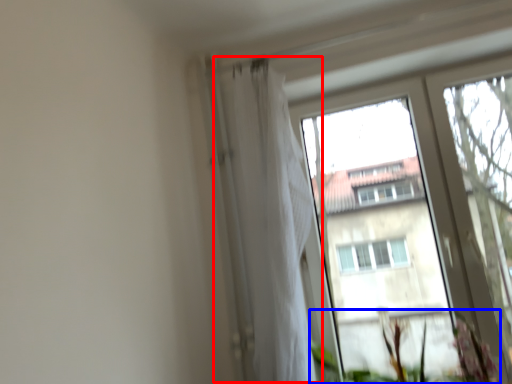
Question: Which point is further to the camera, shower curtain (highlighted by a red box) or vegetation (highlighted by a blue box)?

Choices:
 (A) shower curtain
 (B) vegetation

Answer: (A)